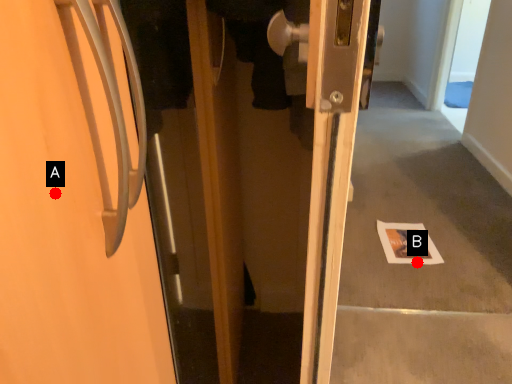
Question: Two points are circled on the image, labeled by A and B beside each circle. Among these points, which one is nearest to the camera?

Choices:
 (A) A is closer
 (B) B is closer

Answer: (A)